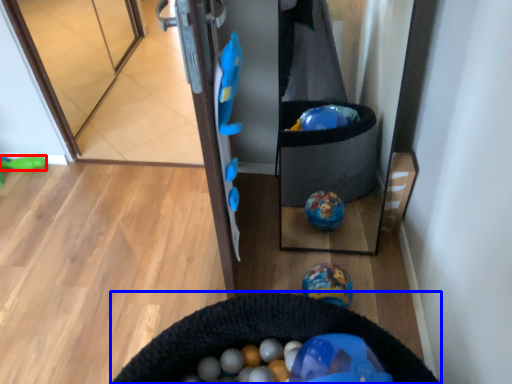
Question: Which object appears farthest to the camera in this image, toy (highlighted by a red box) or cat bed (highlighted by a blue box)?

Choices:
 (A) toy
 (B) cat bed

Answer: (A)